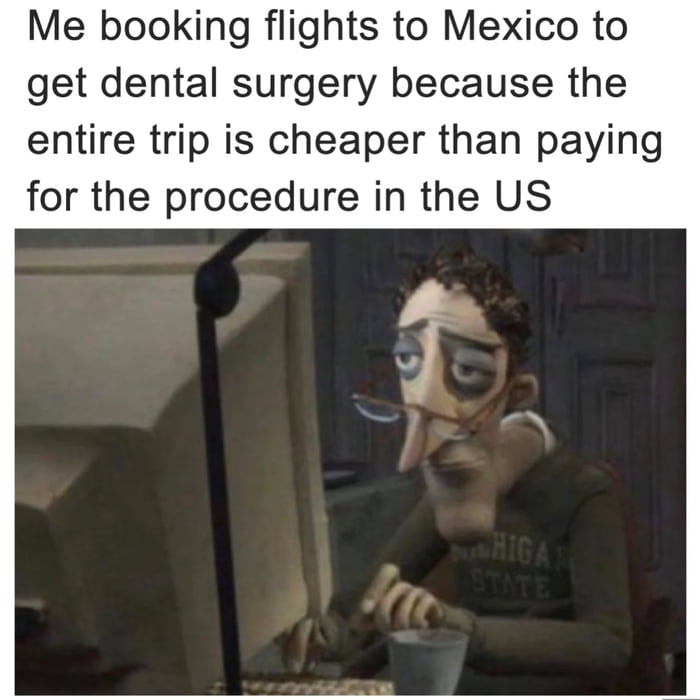
Locate an element on the screen. This screenshot has width=700, height=700. computer monitor is located at coordinates (140, 368).